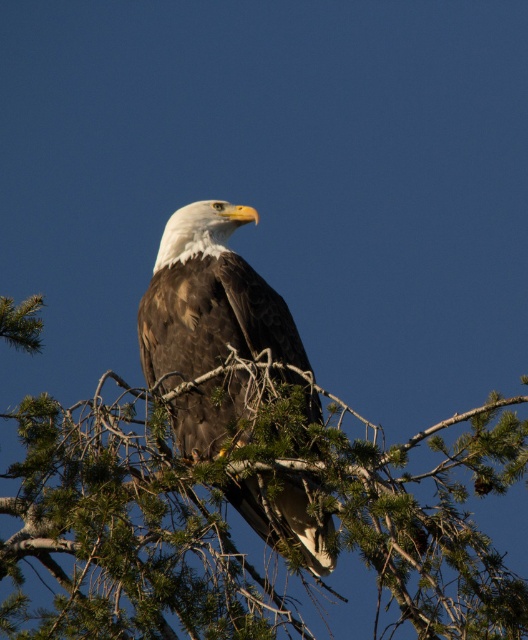
Question: Which of the following is the closest to the observer?

Choices:
 (A) (401, 545)
 (B) (174, 324)

Answer: (A)

Question: Does green needle-like branches at center appear over brown feathered eagle at center?

Choices:
 (A) yes
 (B) no

Answer: (B)

Question: Can you confirm if green needle-like branches at center is thinner than brown feathered eagle at center?

Choices:
 (A) no
 (B) yes

Answer: (A)

Question: Which point is farther to the camera?

Choices:
 (A) (164, 628)
 (B) (174, 260)

Answer: (B)

Question: Is green needle-like branches at center closer to the viewer compared to brown feathered eagle at center?

Choices:
 (A) no
 (B) yes

Answer: (B)